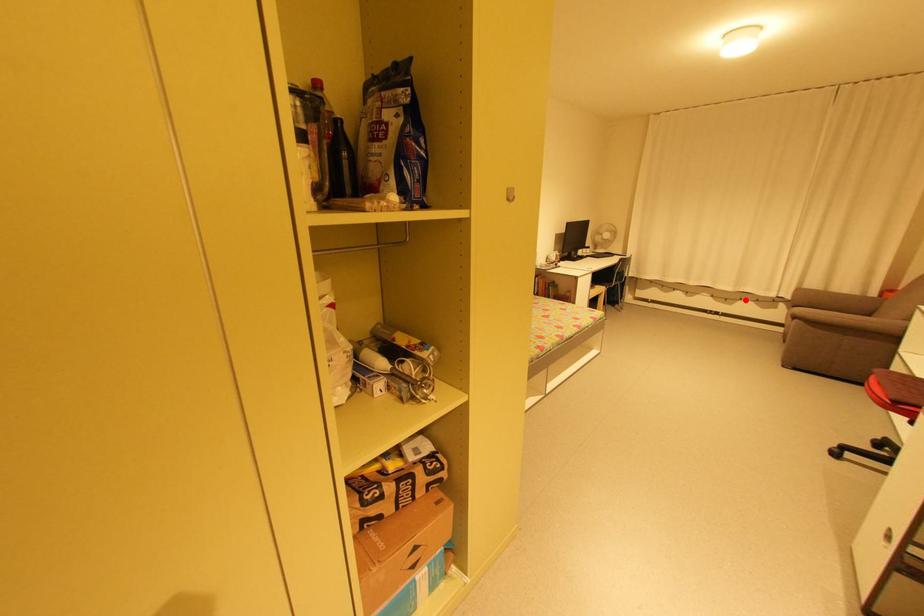
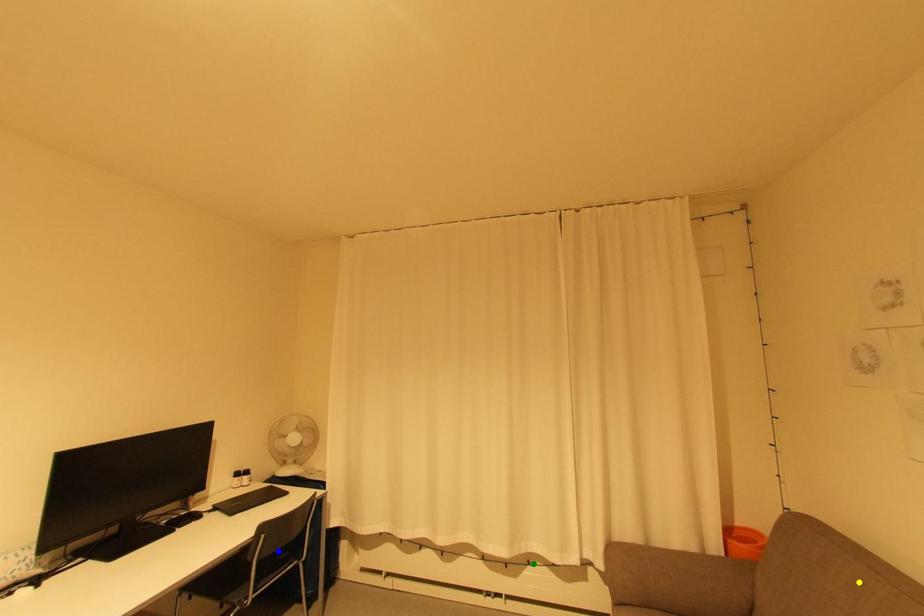
Question: I am providing you with two images of the same scene from different viewpoints. A red point is marked on the first image. You are given multiple points on the second image. Which mark in image 2 goes with the point in image 1?

Choices:
 (A) yellow point
 (B) green point
 (C) blue point

Answer: (B)